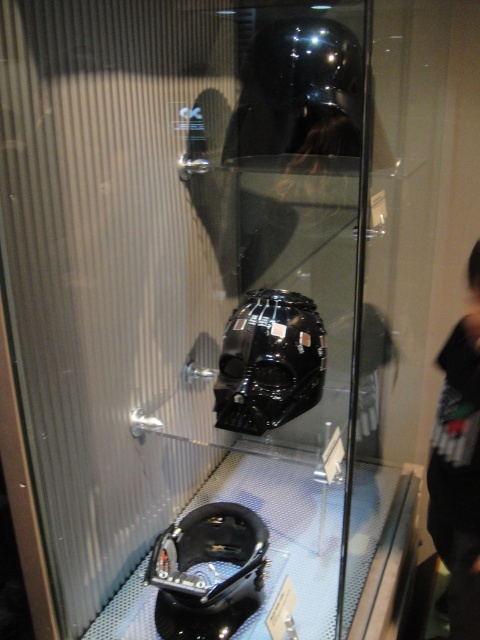
Question: Observing the image, what is the correct spatial positioning of glossy black helmet at upper center in reference to black matte helmet at lower center?

Choices:
 (A) right
 (B) left

Answer: (A)

Question: Is glossy black helmet at center thinner than black matte helmet at lower center?

Choices:
 (A) no
 (B) yes

Answer: (B)

Question: Which of the following is the farthest from the observer?

Choices:
 (A) (197, 552)
 (B) (257, 45)

Answer: (A)

Question: Which object is farther from the camera taking this photo?

Choices:
 (A) glossy black helmet at center
 (B) black matte helmet at lower center
 (C) glossy black helmet at upper center

Answer: (C)

Question: Which is farther from the glossy black helmet at center?

Choices:
 (A) glossy black helmet at upper center
 (B) black matte helmet at lower center

Answer: (A)

Question: Does glossy black helmet at upper center appear on the left side of glossy black helmet at center?

Choices:
 (A) yes
 (B) no

Answer: (B)